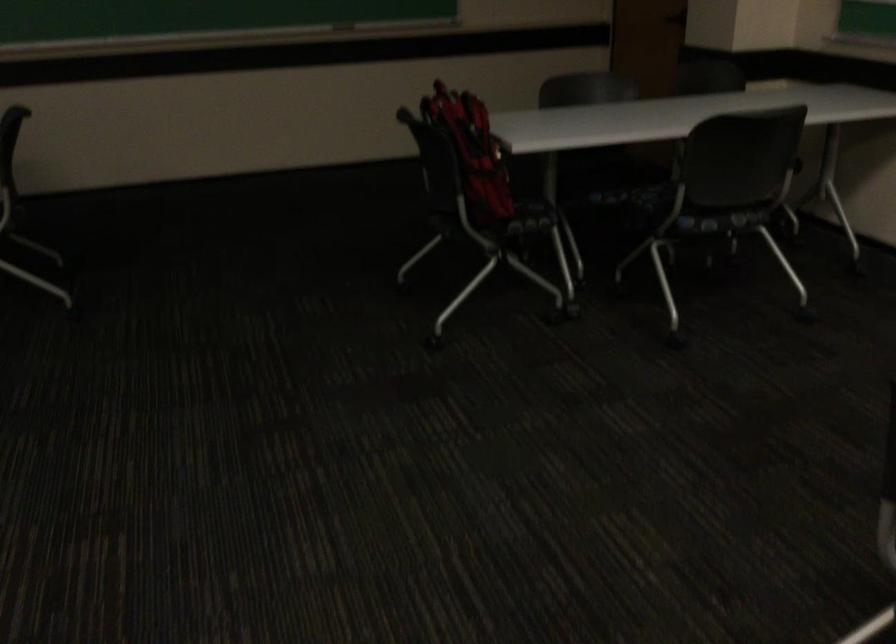
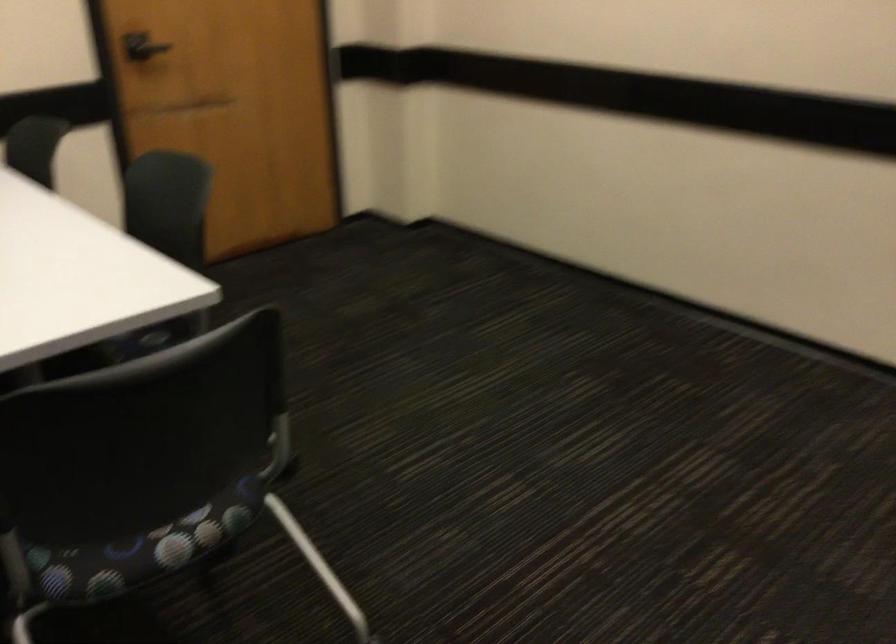
Looking at this image, how did the camera likely rotate?

The rotation direction of the camera is right-down.